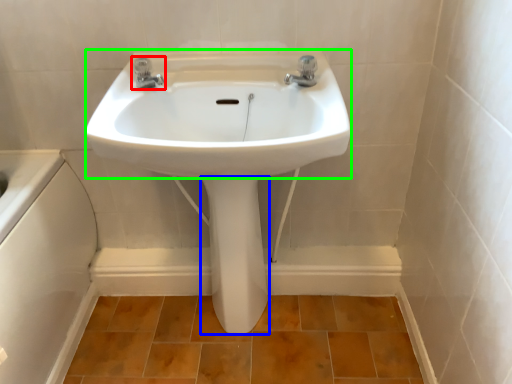
Question: Estimate the real-world distances between objects in this image. Which object is farther from tap (highlighted by a red box), bidet (highlighted by a blue box) or sink (highlighted by a green box)?

Choices:
 (A) bidet
 (B) sink

Answer: (A)